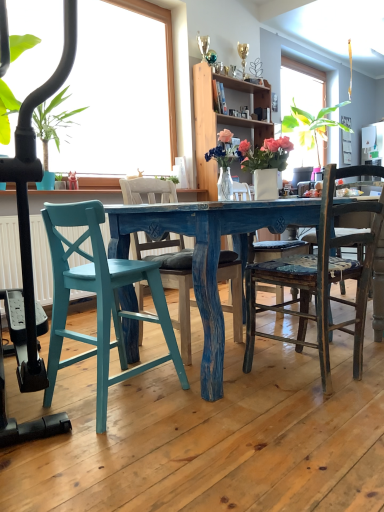
Question: Based on their sizes in the image, would you say wooden cabinet at upper center is bigger or smaller than distressed wood chair at center, which is the 1th chair in right-to-left order?

Choices:
 (A) small
 (B) big

Answer: (B)

Question: Considering the positions of wooden cabinet at upper center and distressed wood chair at center, which is the 3th chair in left-to-right order, in the image, is wooden cabinet at upper center wider or thinner than distressed wood chair at center, which is the 3th chair in left-to-right order,?

Choices:
 (A) thin
 (B) wide

Answer: (A)

Question: Which object is the farthest from the distressed wood chair at center, which is the 3th chair in left-to-right order?

Choices:
 (A) blue painted wood chair at center, positioned as the 2th chair in left-to-right order
 (B) teal painted wood chair at lower left, which appears as the first chair when viewed from the left
 (C) green leafy plant at left
 (D) wooden cabinet at upper center
 (E) white glossy vase at center

Answer: (C)

Question: Based on their relative distances, which object is nearer to the white glossy vase at center?

Choices:
 (A) wooden cabinet at upper center
 (B) blue painted wood chair at center, positioned as the 2th chair in left-to-right order
 (C) green leafy plant at left
 (D) teal painted wood chair at lower left, which appears as the first chair when viewed from the left
 (E) distressed wood chair at center, which is the 1th chair in right-to-left order

Answer: (B)